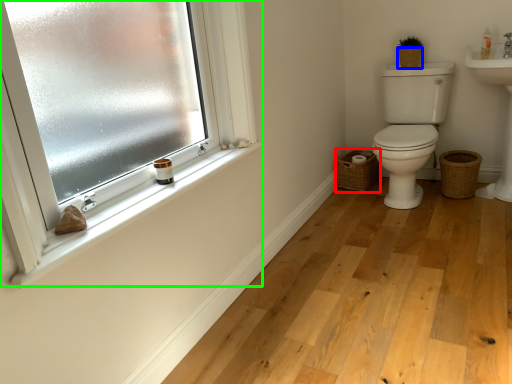
Question: Estimate the real-world distances between objects in this image. Which object is farther from basket (highlighted by a red box), basket (highlighted by a blue box) or window (highlighted by a green box)?

Choices:
 (A) basket
 (B) window

Answer: (B)